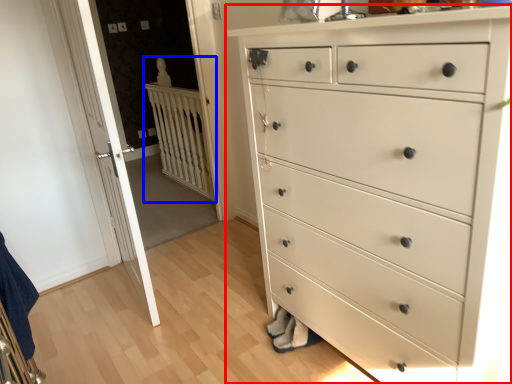
Question: Which object is closer to the camera taking this photo, chest of drawers (highlighted by a red box) or balustrade (highlighted by a blue box)?

Choices:
 (A) chest of drawers
 (B) balustrade

Answer: (A)